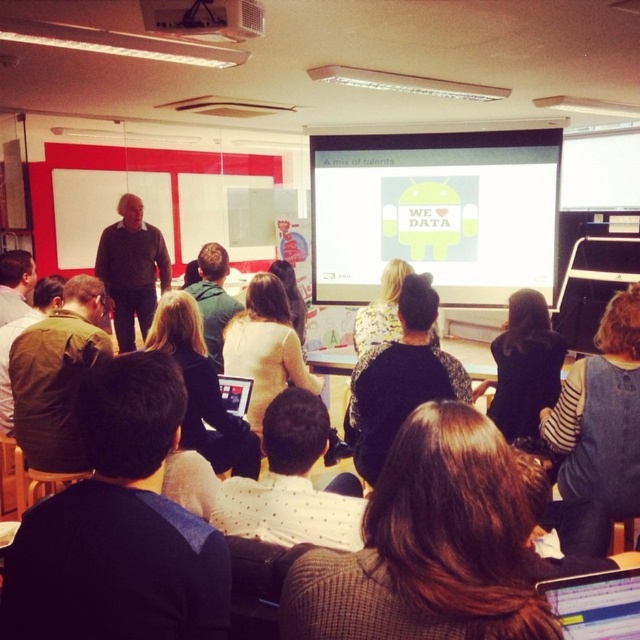
Is point (99, 337) positioned before point (289, 266)?

Yes, it is.

Does point (40, 470) come closer to viewer compared to point (296, 294)?

Yes, it is in front of point (296, 294).

This screenshot has width=640, height=640. What are the coordinates of `matte green jacket at left` in the screenshot? It's located at (58, 376).

Is brown knitted sweater at center shorter than green fabric jacket at left?

Yes, brown knitted sweater at center is shorter than green fabric jacket at left.

Is point (442, 608) less distant than point (4, 385)?

Yes, it is.

Locate an element on the screen. The height and width of the screenshot is (640, 640). brown knitted sweater at center is located at coordinates (428, 545).

Looking at this image, does white plastic projector at upper center have a larger size compared to floral-patterned blouse at center?

No, white plastic projector at upper center is not bigger than floral-patterned blouse at center.

Does point (193, 19) lie in front of point (390, 332)?

Yes, it is.

At what (x,y) coordinates should I click in order to perform the action: click on white plastic projector at upper center. Please return your answer as a coordinate pair (x, y). The image size is (640, 640). Looking at the image, I should click on (204, 19).